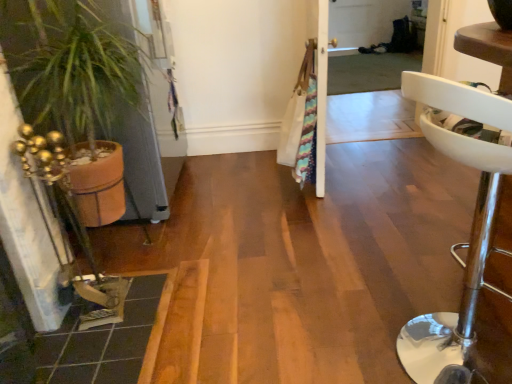
Question: From the image's perspective, relative to terracotta pot at left, is transparent plastic screen door at upper center above or below?

Choices:
 (A) above
 (B) below

Answer: (A)

Question: In the image, is transparent plastic screen door at upper center on the left side or the right side of terracotta pot at left?

Choices:
 (A) right
 (B) left

Answer: (A)

Question: Which of these objects is positioned farthest from the white leather stool at right?

Choices:
 (A) terracotta pot at left
 (B) transparent plastic screen door at upper center

Answer: (B)

Question: Which object is the farthest from the white leather stool at right?

Choices:
 (A) transparent plastic screen door at upper center
 (B) terracotta pot at left

Answer: (A)